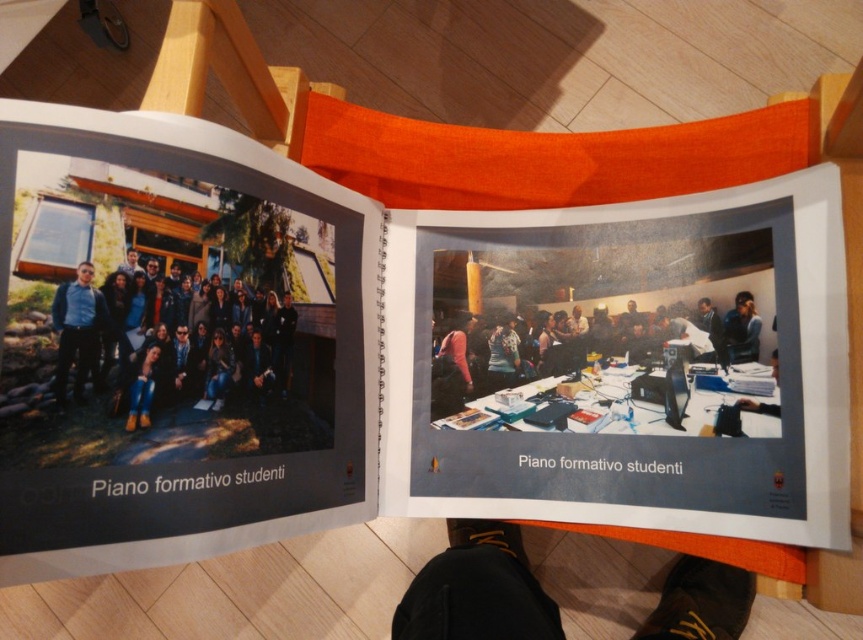
Question: Which point is farther to the camera?

Choices:
 (A) dark blue jeans at center
 (B) black leather shoes at lower center
 (C) matte blue shirt at center

Answer: (B)

Question: Is dark blue jeans at center in front of blue fabric shirt at center?

Choices:
 (A) yes
 (B) no

Answer: (A)

Question: Does dark blue jeans at center come in front of blue fabric shirt at center?

Choices:
 (A) no
 (B) yes

Answer: (B)

Question: Considering the real-world distances, which object is farthest from the blue fabric shirt at center?

Choices:
 (A) matte blue shirt at center
 (B) black leather shoes at lower center

Answer: (B)

Question: Where is matte blue shirt at center located in relation to blue fabric shirt at center in the image?

Choices:
 (A) below
 (B) above

Answer: (A)

Question: Which point is farther to the camera?

Choices:
 (A) (206, 310)
 (B) (74, 385)
 (C) (402, 605)
 (D) (728, 330)

Answer: (C)